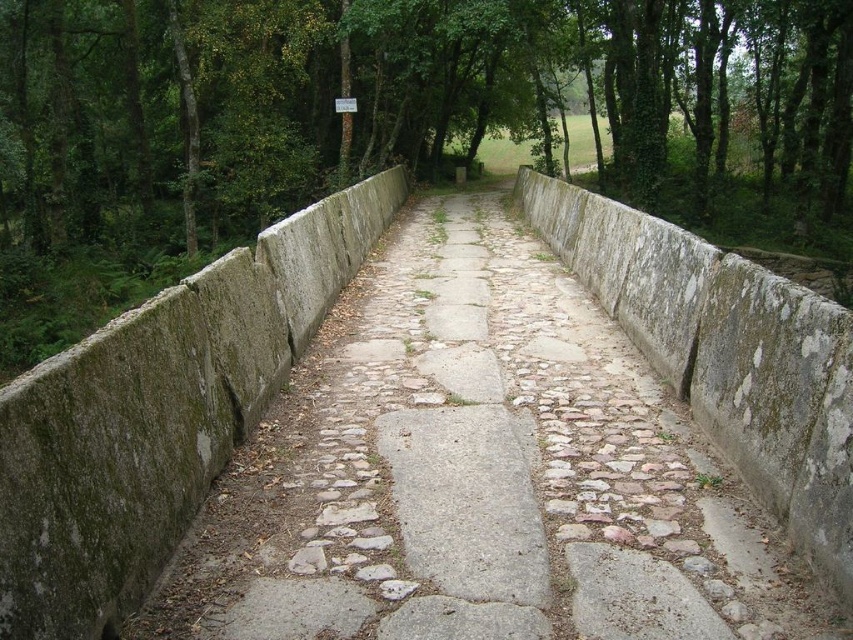
Is point (563, 316) positioned behind point (107, 234)?

No, it is not.

Identify the location of gray stone path at center. (479, 474).